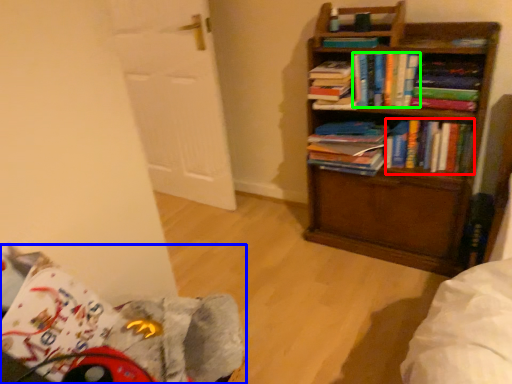
Question: Which object is positioned closest to book (highlighted by a red box)? Select from swivel chair (highlighted by a blue box) and book (highlighted by a green box).

Choices:
 (A) swivel chair
 (B) book

Answer: (B)